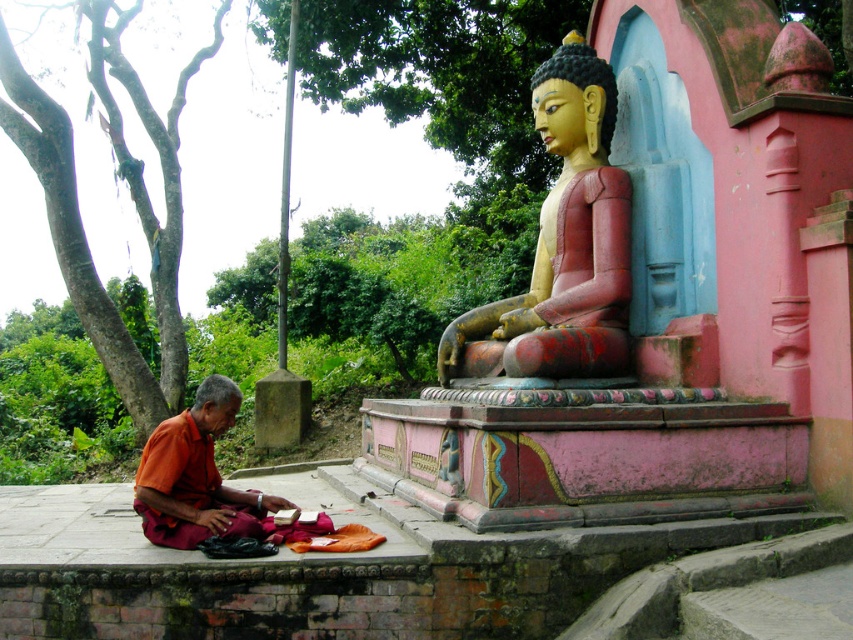
Question: Is polished wood statue at center thinner than orange cloth at lower left?

Choices:
 (A) no
 (B) yes

Answer: (A)

Question: Which point is farther to the camera?

Choices:
 (A) orange cloth at lower left
 (B) polished wood statue at center

Answer: (B)

Question: Does polished wood statue at center lie in front of orange cloth at lower left?

Choices:
 (A) yes
 (B) no

Answer: (B)

Question: In this image, where is polished wood statue at center located relative to orange cloth at lower left?

Choices:
 (A) left
 (B) right

Answer: (B)